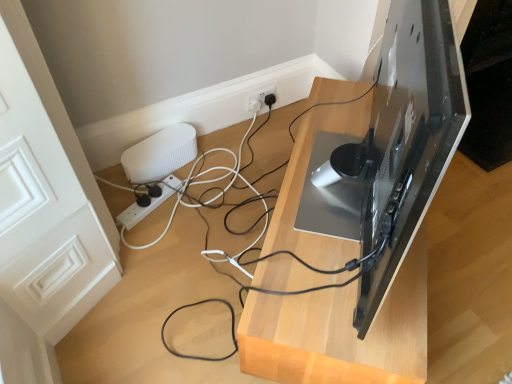
You are a GUI agent. You are given a task and a screenshot of the screen. Output one action in this format:
    pyautogui.click(x=<x>, y=<y>)
    Task: Click on the free location in front of white plastic power strip at lower center
    This screenshot has width=512, height=384.
    Given the screenshot: What is the action you would take?
    pyautogui.click(x=153, y=243)